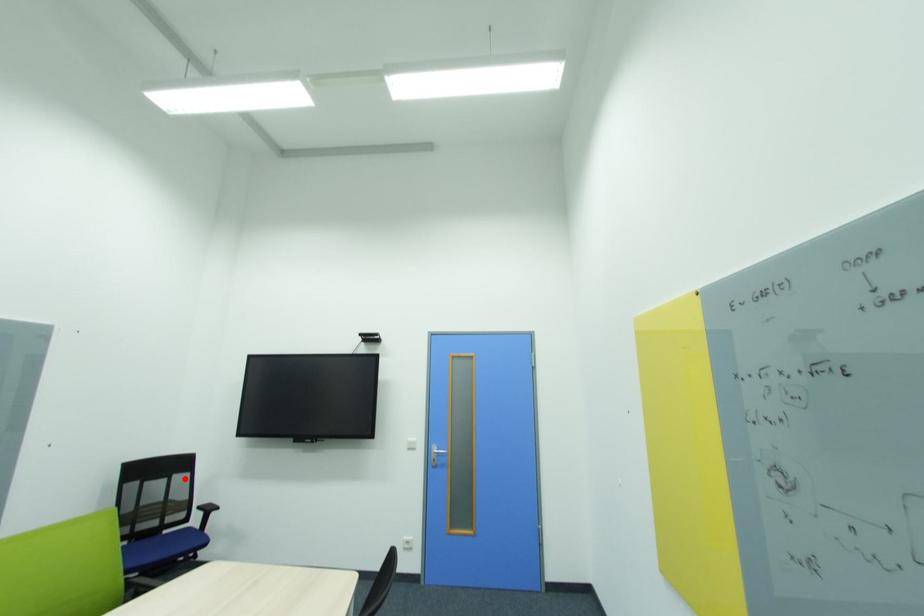
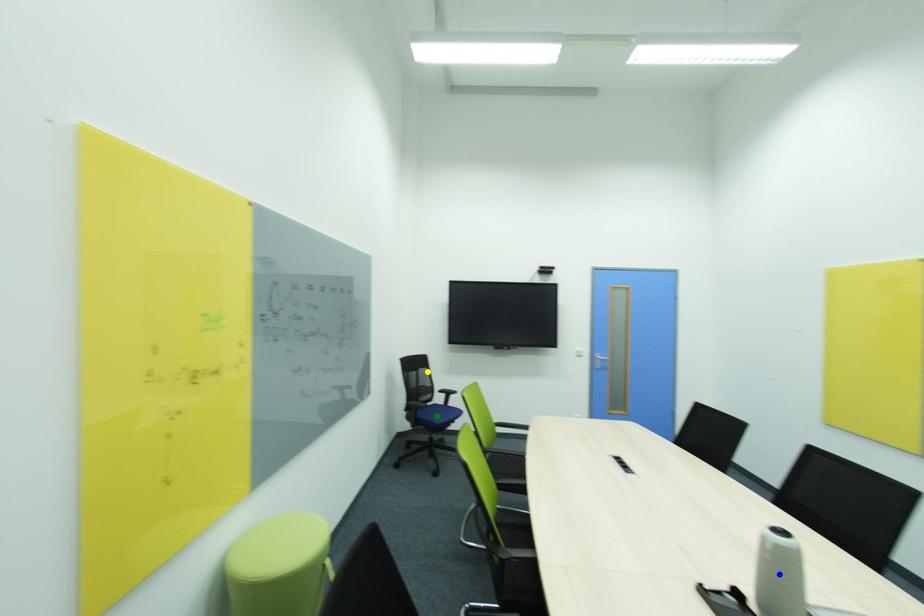
Question: I am providing you with two images of the same scene from different viewpoints. A red point is marked on the first image. You are given multiple points on the second image. Which point in image 2 is actually the same real-world point as the red point in image 1?

Choices:
 (A) blue point
 (B) green point
 (C) yellow point

Answer: (C)